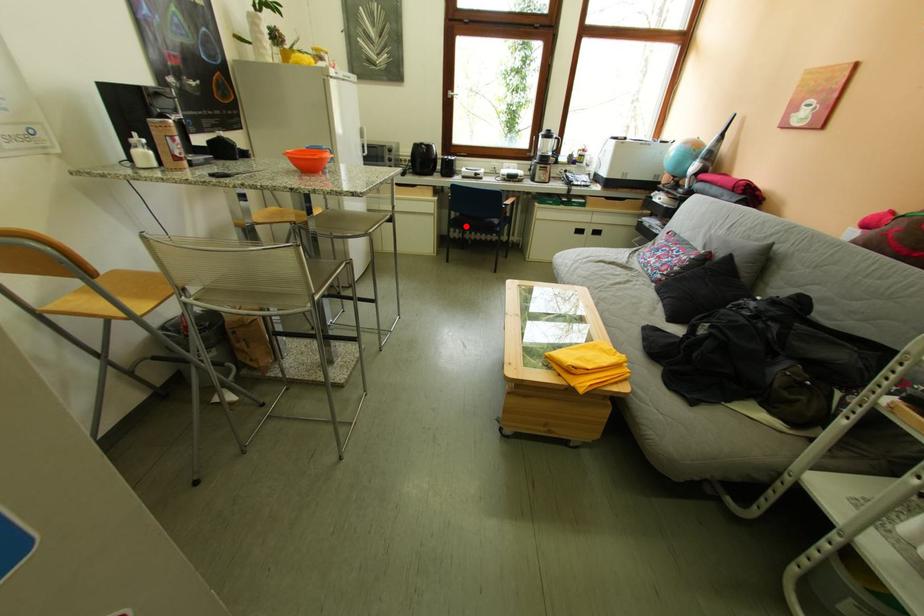
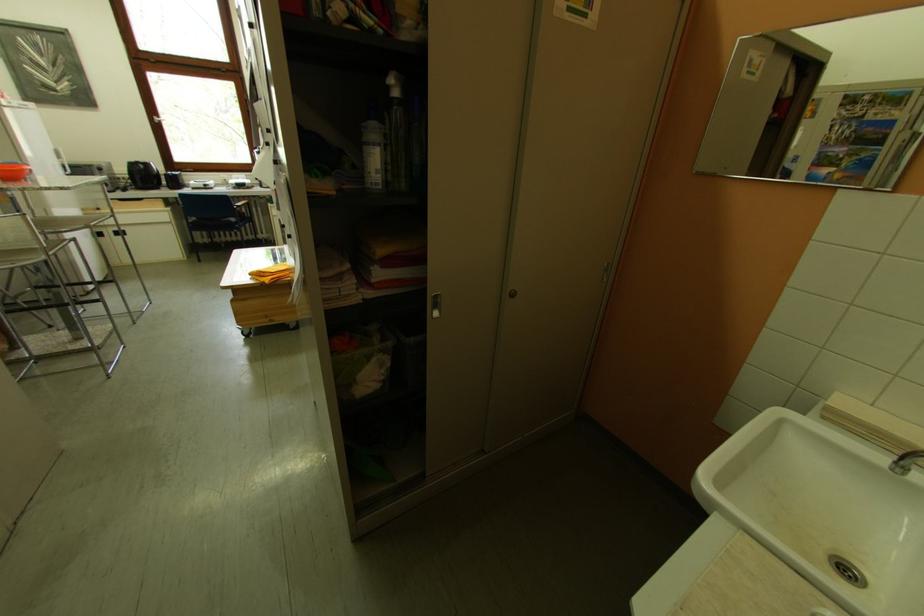
Question: I am providing you with two images of the same scene from different viewpoints. Image1 has a red point marked. In image2, the corresponding 3D location appears at what relative position? Reply with the corresponding letter.

Choices:
 (A) Closer
 (B) Farther

Answer: (B)